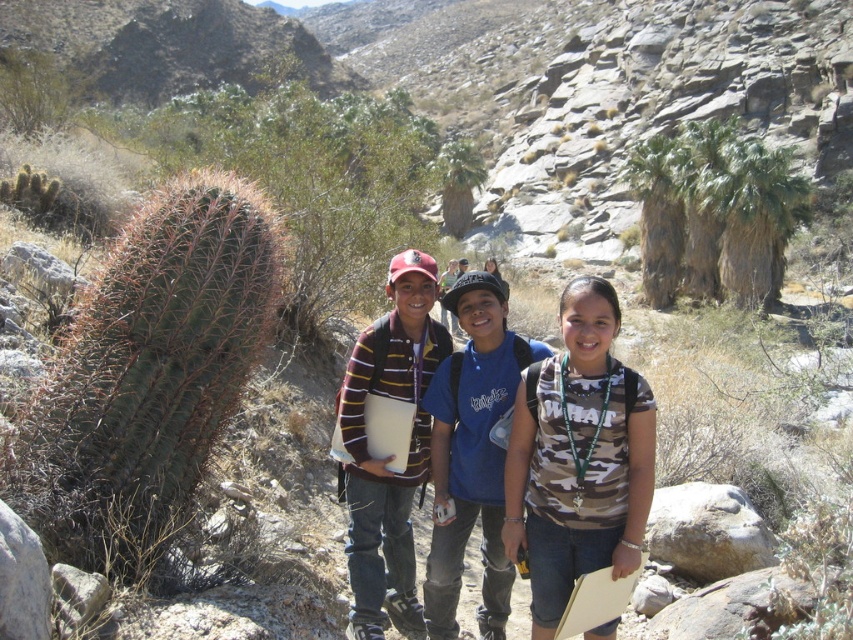
Question: Considering the relative positions of camouflage fabric shirt at center and camo fabric shirt at center in the image provided, where is camouflage fabric shirt at center located with respect to camo fabric shirt at center?

Choices:
 (A) below
 (B) above

Answer: (B)

Question: Which point is closer to the camera?

Choices:
 (A) camo fabric shirt at center
 (B) camouflage fabric shirt at center

Answer: (A)

Question: Based on their relative distances, which object is nearer to the blue cotton shirt at center?

Choices:
 (A) striped wool sweater at center
 (B) camo fabric shirt at center
 (C) camouflage fabric shirt at center

Answer: (C)

Question: Does striped wool sweater at center have a greater width compared to blue cotton shirt at center?

Choices:
 (A) no
 (B) yes

Answer: (B)

Question: Observing the image, what is the correct spatial positioning of camo fabric shirt at center in reference to striped wool sweater at center?

Choices:
 (A) left
 (B) right

Answer: (B)

Question: Considering the real-world distances, which object is closest to the camo fabric shirt at center?

Choices:
 (A) striped wool sweater at center
 (B) camouflage fabric shirt at center
 (C) blue cotton shirt at center

Answer: (C)